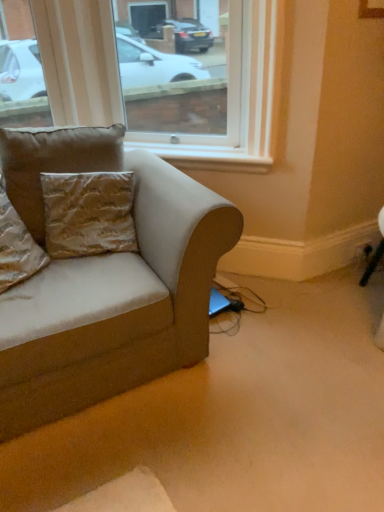
The image size is (384, 512). Identify the location of vacant region above white painted wood at upper center (from a real-world perspective). (208, 147).